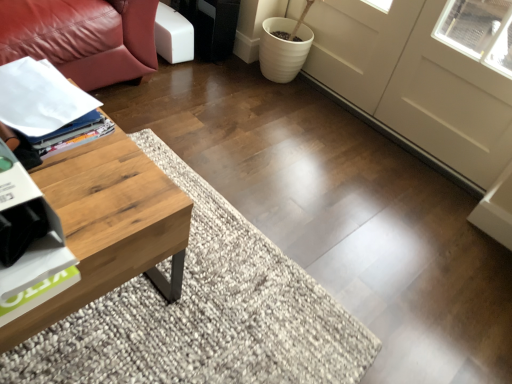
Question: Is woodenmaterial/texturecoffee table at left further to camera compared to white glossy magazine at left?

Choices:
 (A) no
 (B) yes

Answer: (A)

Question: Considering the relative sizes of woodenmaterial/texturecoffee table at left and white glossy magazine at left in the image provided, is woodenmaterial/texturecoffee table at left shorter than white glossy magazine at left?

Choices:
 (A) no
 (B) yes

Answer: (A)

Question: Can you see woodenmaterial/texturecoffee table at left touching white glossy magazine at left?

Choices:
 (A) no
 (B) yes

Answer: (A)

Question: Does woodenmaterial/texturecoffee table at left appear on the right side of white glossy magazine at left?

Choices:
 (A) no
 (B) yes

Answer: (A)

Question: Can you confirm if woodenmaterial/texturecoffee table at left is thinner than white glossy magazine at left?

Choices:
 (A) yes
 (B) no

Answer: (B)

Question: Does woodenmaterial/texturecoffee table at left have a greater width compared to white glossy magazine at left?

Choices:
 (A) no
 (B) yes

Answer: (B)

Question: Could you tell me if woodenmaterial/texturecoffee table at left is turned towards white matte screen door at center?

Choices:
 (A) yes
 (B) no

Answer: (B)

Question: From the image's perspective, is woodenmaterial/texturecoffee table at left under white matte screen door at center?

Choices:
 (A) no
 (B) yes

Answer: (B)

Question: Is woodenmaterial/texturecoffee table at left positioned with its back to white matte screen door at center?

Choices:
 (A) no
 (B) yes

Answer: (A)

Question: Would you consider woodenmaterial/texturecoffee table at left to be distant from white matte screen door at center?

Choices:
 (A) no
 (B) yes

Answer: (B)

Question: From a real-world perspective, is woodenmaterial/texturecoffee table at left under white matte screen door at center?

Choices:
 (A) yes
 (B) no

Answer: (A)

Question: Does woodenmaterial/texturecoffee table at left have a greater width compared to white matte screen door at center?

Choices:
 (A) no
 (B) yes

Answer: (B)

Question: Can you confirm if white matte screen door at center is positioned to the left of white glossy magazine at left?

Choices:
 (A) no
 (B) yes

Answer: (A)